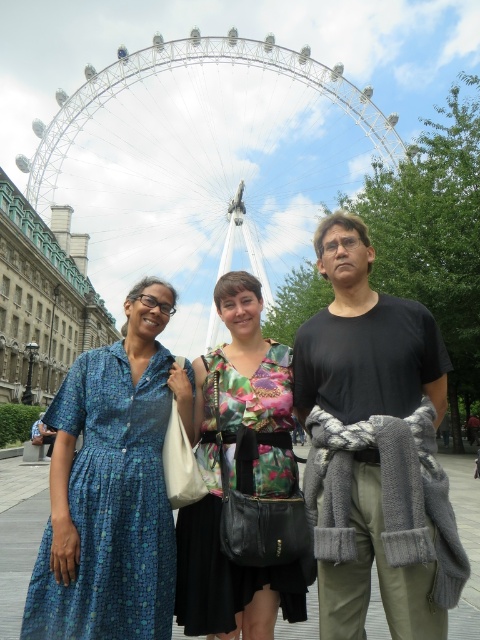
Measure the distance from white metal ferris wheel at upper center to dark gray knit scarf at center.

They are 108.77 meters apart.

Can you confirm if white metal ferris wheel at upper center is positioned below dark gray knit scarf at center?

No, white metal ferris wheel at upper center is not below dark gray knit scarf at center.

Locate an element on the screen. white metal ferris wheel at upper center is located at coordinates point(204,161).

At what (x,y) coordinates should I click in order to perform the action: click on white metal ferris wheel at upper center. Please return your answer as a coordinate pair (x, y). The height and width of the screenshot is (640, 480). Looking at the image, I should click on (204, 161).

Measure the distance between white metal ferris wheel at upper center and floral fabric dress at center.

white metal ferris wheel at upper center is 360.69 feet from floral fabric dress at center.

Is white metal ferris wheel at upper center positioned behind floral fabric dress at center?

Yes, it is.

From the picture: Measure the distance between white metal ferris wheel at upper center and camera.

They are 463.58 feet apart.

Find the location of `white metal ferris wheel at upper center`. white metal ferris wheel at upper center is located at coordinates click(x=204, y=161).

Between dark gray knit scarf at center and floral fabric dress at center, which one appears on the left side from the viewer's perspective?

Positioned to the left is floral fabric dress at center.

Which of these two, dark gray knit scarf at center or floral fabric dress at center, stands taller?

With more height is dark gray knit scarf at center.

Is point (437, 614) closer to camera compared to point (250, 296)?

Yes, point (437, 614) is in front of point (250, 296).

Image resolution: width=480 pixels, height=640 pixels. Find the location of `dark gray knit scarf at center`. dark gray knit scarf at center is located at coordinates (374, 449).